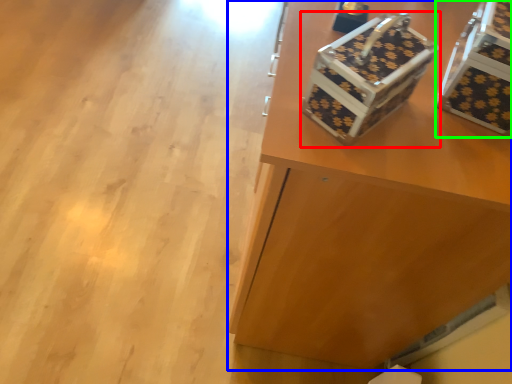
Question: Which is farther away from shoe box (highlighted by a red box)? furniture (highlighted by a blue box) or storage box (highlighted by a green box)?

Choices:
 (A) furniture
 (B) storage box

Answer: (A)